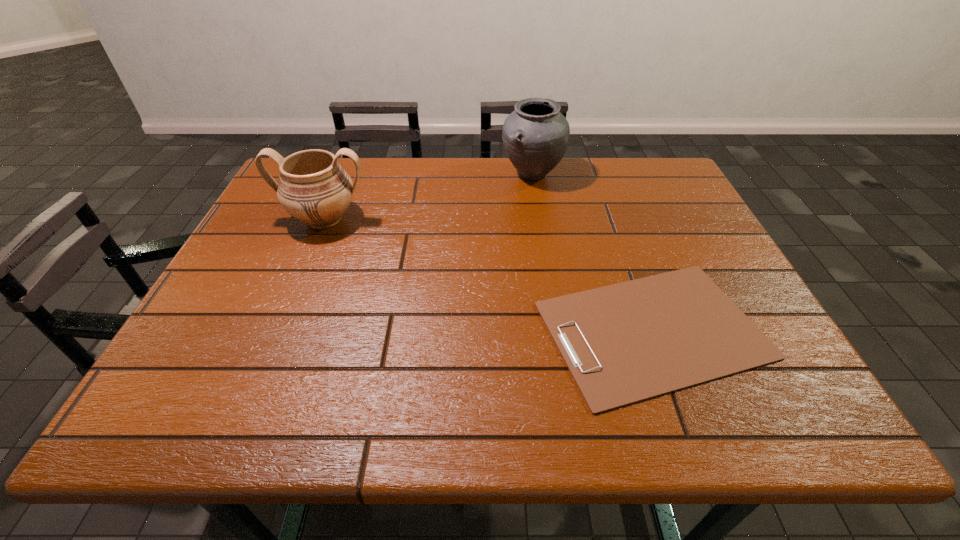
Choose which object is the second nearest neighbor to the shortest object. Please provide its 2D coordinates. Your answer should be formatted as a tuple, i.e. [(x, y)], where the tuple contains the x and y coordinates of a point satisfying the conditions above.

[(313, 187)]

Where is `free location that satisfies the following two spatial constraints: 1. on the front-facing side of the leftmost object; 2. on the left side of the nearest object`? This screenshot has height=540, width=960. free location that satisfies the following two spatial constraints: 1. on the front-facing side of the leftmost object; 2. on the left side of the nearest object is located at coordinates (277, 330).

This screenshot has width=960, height=540. What are the coordinates of `vacant area in the image that satisfies the following two spatial constraints: 1. on the front-facing side of the clipboard; 2. on the right side of the second farthest object` in the screenshot? It's located at (277, 330).

The image size is (960, 540). What are the coordinates of `free space that satisfies the following two spatial constraints: 1. on the front-facing side of the nearer urn; 2. on the right side of the clipboard` in the screenshot? It's located at (277, 330).

The width and height of the screenshot is (960, 540). Find the location of `vacant space that satisfies the following two spatial constraints: 1. on the front-facing side of the left urn; 2. on the right side of the shortest object`. vacant space that satisfies the following two spatial constraints: 1. on the front-facing side of the left urn; 2. on the right side of the shortest object is located at coordinates (277, 330).

Find the location of a particular element. vacant area that satisfies the following two spatial constraints: 1. on the front-facing side of the leftmost object; 2. on the right side of the shortest object is located at coordinates (277, 330).